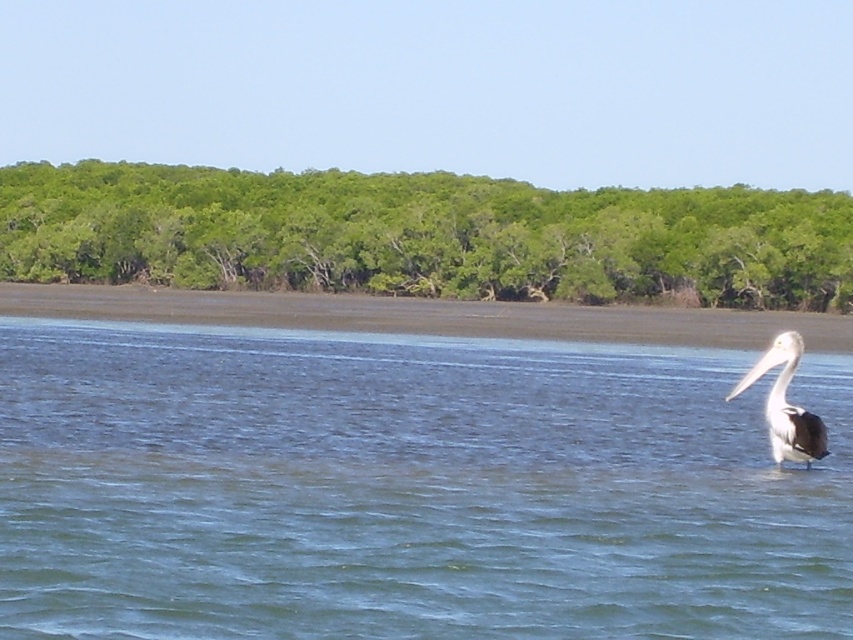
You are a birdwatcher standing on the bank of the river. You see the green leafy trees at upper center and the white matte pelican at right. How far apart are these two objects?

The distance between the green leafy trees at upper center and the white matte pelican at right is 223.69 feet.

You are a birdwatcher observing the scene. You notice the green leafy trees at upper center and the white matte pelican at right. Which object takes up more space in the image?

The green leafy trees at upper center takes up more space in the image than the white matte pelican at right because it is larger in size.